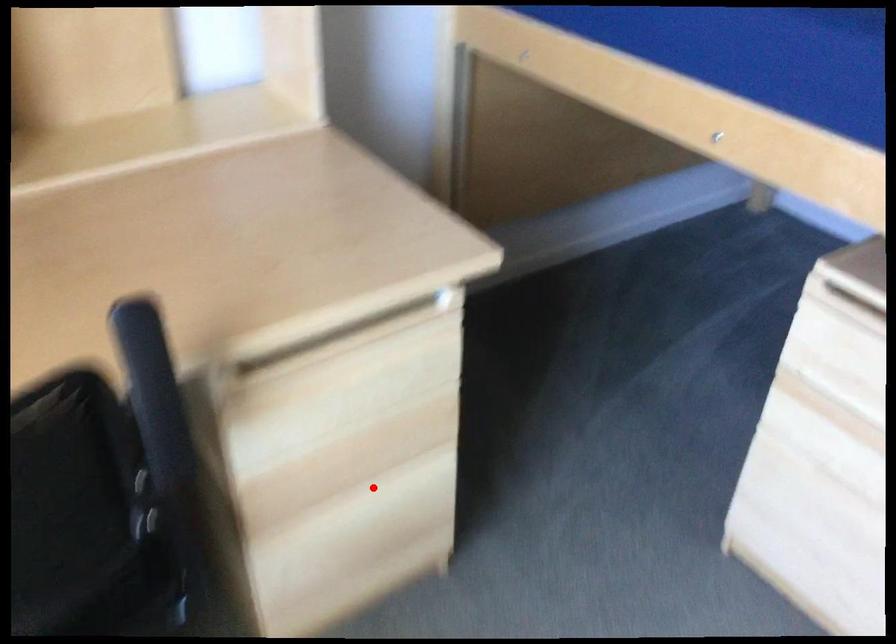
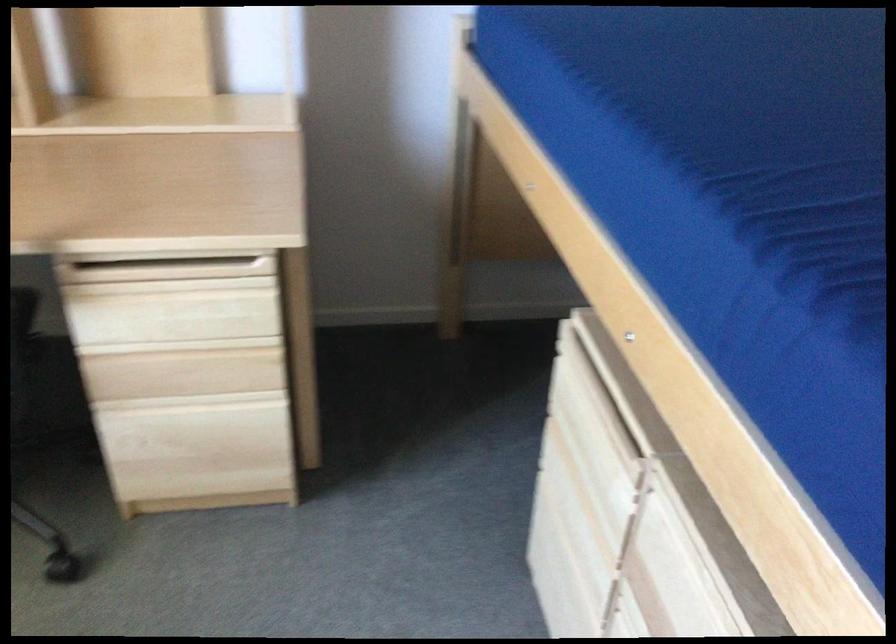
Question: I am providing you with two images of the same scene from different viewpoints. Image1 has a red point marked. In image2, the corresponding 3D location appears at what relative position? Reply with the corresponding letter.

Choices:
 (A) Closer
 (B) Farther

Answer: (B)